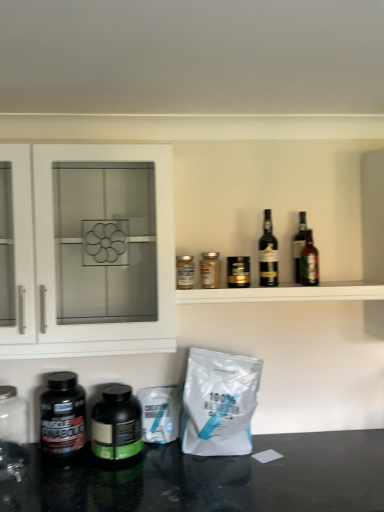
Question: Considering the positions of black matte bottle at lower center, which ranks as the 6th bottle in right-to-left order, and matte glass jar at center, the 3th bottle positioned from the left, in the image, is black matte bottle at lower center, which ranks as the 6th bottle in right-to-left order, taller or shorter than matte glass jar at center, the 3th bottle positioned from the left,?

Choices:
 (A) tall
 (B) short

Answer: (A)

Question: Would you say black matte bottle at lower center, the second bottle viewed from the left, is inside or outside matte glass jar at center, the 3th bottle positioned from the left?

Choices:
 (A) inside
 (B) outside

Answer: (B)

Question: Considering the real-world distances, which object is closest to the gold metallic can at center?

Choices:
 (A) white glossy cabinet at upper left
 (B) black matte bottle at lower center, the second bottle viewed from the left
 (C) clear glass bottles at upper center
 (D) white matte bag at lower center
 (E) dark glass bottle at upper right, the third bottle in the right-to-left sequence

Answer: (E)

Question: Based on their relative distances, which object is farther from the black matte bottle at lower center, the second bottle viewed from the left?

Choices:
 (A) white glossy cabinet at upper left
 (B) black plastic bottle at lower left, which is the 1th bottle in left-to-right order
 (C) transparent glass jar at lower left
 (D) clear glass bottles at upper center
 (E) matte glass jar at center, the 3th bottle positioned from the left

Answer: (D)